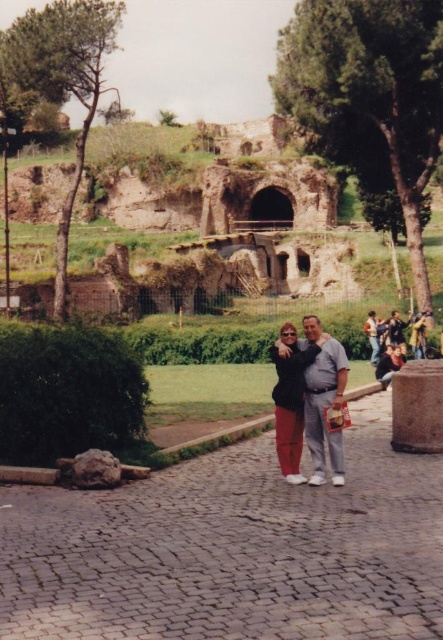
Which of these two, matte black jacket at center or leather jacket at center, stands taller?

matte black jacket at center

Can you confirm if matte black jacket at center is positioned to the left of leather jacket at center?

Correct, you'll find matte black jacket at center to the left of leather jacket at center.

I want to click on matte black jacket at center, so click(x=291, y=401).

Identify the location of matte black jacket at center. The image size is (443, 640). (291, 401).

Does leather jacket at center have a greater height compared to smooth gray shirt at right?

Yes.

Who is shorter, leather jacket at center or smooth gray shirt at right?

With less height is smooth gray shirt at right.

Which is behind, point (411, 326) or point (396, 337)?

The point (411, 326) is more distant.

I want to click on leather jacket at center, so click(395, 333).

Can you confirm if matte black jacket at center is smaller than smooth gray shirt at right?

No, matte black jacket at center is not smaller than smooth gray shirt at right.

Between matte black jacket at center and smooth gray shirt at right, which one is positioned lower?

matte black jacket at center

The width and height of the screenshot is (443, 640). Find the location of `matte black jacket at center`. matte black jacket at center is located at coordinates (291, 401).

You are a GUI agent. You are given a task and a screenshot of the screen. Output one action in this format:
    pyautogui.click(x=<x>, y=<y>)
    Task: Click on the matte black jacket at center
    This screenshot has width=443, height=640.
    Given the screenshot: What is the action you would take?
    pyautogui.click(x=291, y=401)